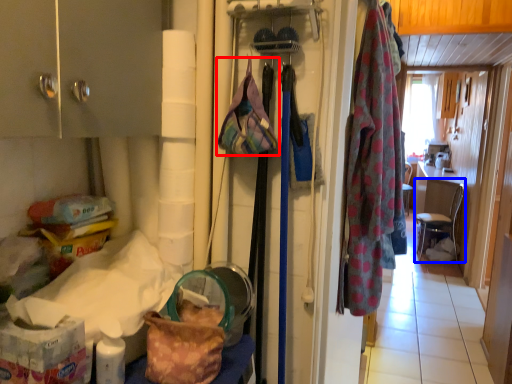
Question: Which point is closer to the camera, handbag (highlighted by a red box) or chair (highlighted by a blue box)?

Choices:
 (A) handbag
 (B) chair

Answer: (A)